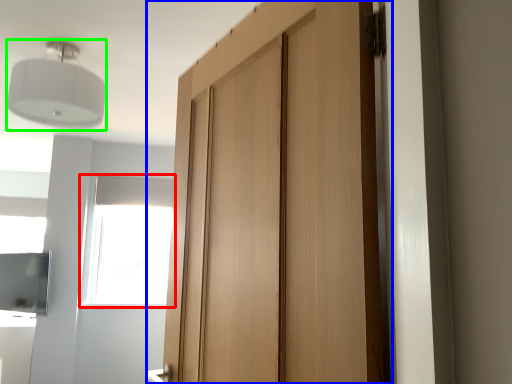
Question: Which is nearer to the window (highlighted by a red box)? door (highlighted by a blue box) or light fixture (highlighted by a green box).

Choices:
 (A) door
 (B) light fixture

Answer: (B)